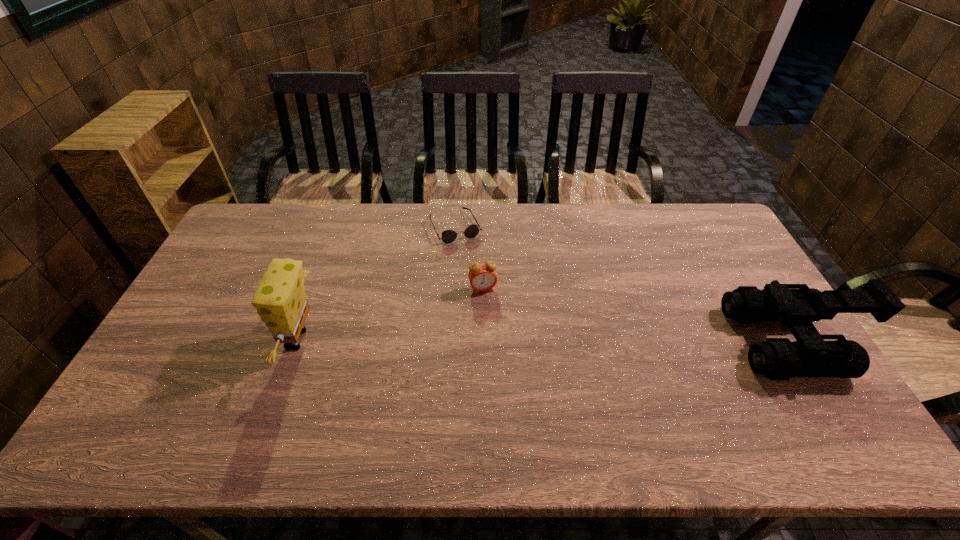
What are the coordinates of `free spot between the rightmost object and the farthest object` in the screenshot? It's located at (624, 284).

At what (x,y) coordinates should I click in order to perform the action: click on free space between the sunglasses and the alarm clock. Please return your answer as a coordinate pair (x, y). Looking at the image, I should click on (469, 258).

The image size is (960, 540). What are the coordinates of `blank region between the tallest object and the sunglasses` in the screenshot? It's located at (377, 283).

At what (x,y) coordinates should I click in order to perform the action: click on free point between the binoculars and the second shortest object. Please return your answer as a coordinate pair (x, y). This screenshot has height=540, width=960. Looking at the image, I should click on (637, 315).

Find the location of a particular element. The height and width of the screenshot is (540, 960). vacant area that lies between the sponge and the second tallest object is located at coordinates (545, 340).

Where is `vacant area that lies between the sponge and the farthest object`? The height and width of the screenshot is (540, 960). vacant area that lies between the sponge and the farthest object is located at coordinates (377, 283).

Where is `vacant space in between the tallest object and the shortest object`? The height and width of the screenshot is (540, 960). vacant space in between the tallest object and the shortest object is located at coordinates (377, 283).

The height and width of the screenshot is (540, 960). Identify the location of free spot between the farthest object and the tallest object. (377, 283).

Where is `free spot between the binoculars and the sunglasses`? The image size is (960, 540). free spot between the binoculars and the sunglasses is located at coordinates (624, 284).

Image resolution: width=960 pixels, height=540 pixels. Find the location of `vacant region between the rightmost object and the farthest object`. vacant region between the rightmost object and the farthest object is located at coordinates (624, 284).